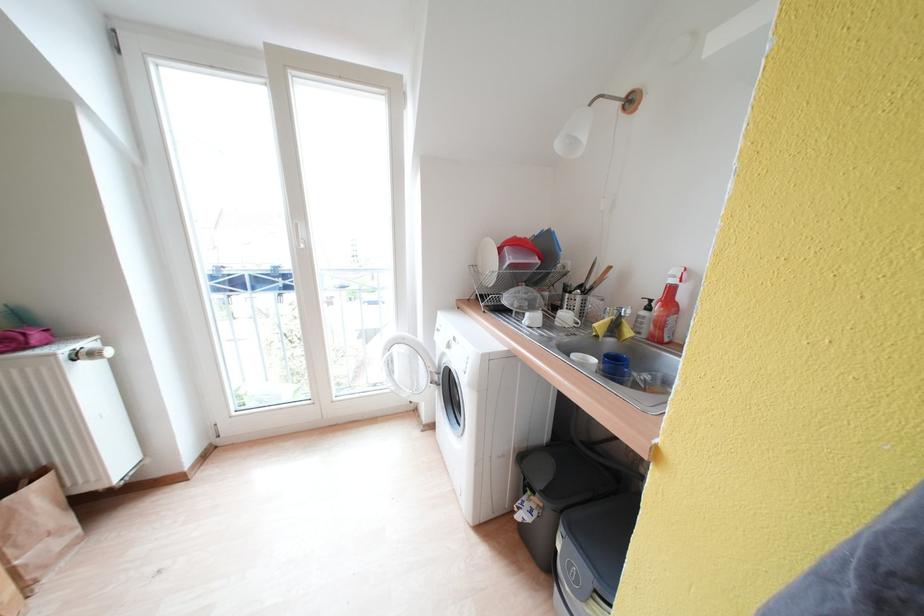
Where is `brown paper bag`? This screenshot has height=616, width=924. brown paper bag is located at coordinates (34, 527).